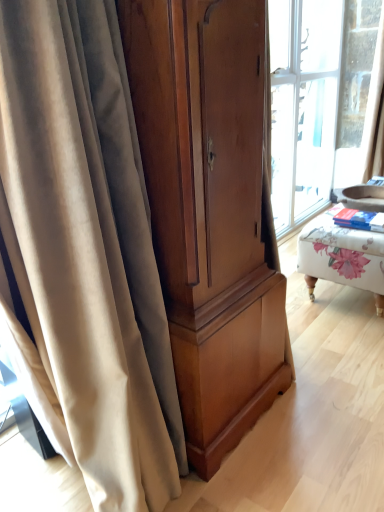
You are a GUI agent. You are given a task and a screenshot of the screen. Output one action in this format:
    pyautogui.click(x=<x>, y=<y>)
    Task: Click on the free location in front of matte wood cabinet at center
    
    Given the screenshot: What is the action you would take?
    pyautogui.click(x=267, y=482)